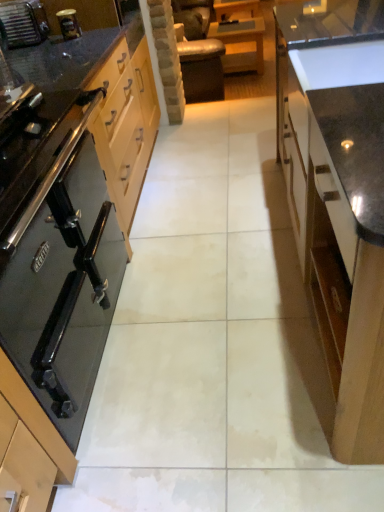
Question: Is black glass stove at left, which is the first cabinetry from left to right, to the left of brushed metal toaster at upper left from the viewer's perspective?

Choices:
 (A) no
 (B) yes

Answer: (A)

Question: Does black glass stove at left, which is counted as the 2th cabinetry, starting from the right, have a smaller size compared to brushed metal toaster at upper left?

Choices:
 (A) no
 (B) yes

Answer: (A)

Question: Considering the relative positions of black glass stove at left, which is counted as the 2th cabinetry, starting from the right, and brushed metal toaster at upper left in the image provided, is black glass stove at left, which is counted as the 2th cabinetry, starting from the right, behind brushed metal toaster at upper left?

Choices:
 (A) yes
 (B) no

Answer: (B)

Question: From a real-world perspective, is black glass stove at left, which is counted as the 2th cabinetry, starting from the right, on top of brushed metal toaster at upper left?

Choices:
 (A) no
 (B) yes

Answer: (A)

Question: Are black glass stove at left, which is counted as the 2th cabinetry, starting from the right, and brushed metal toaster at upper left located far from each other?

Choices:
 (A) no
 (B) yes

Answer: (A)

Question: Considering the positions of brushed metal toaster at upper left and wooden table at center in the image, is brushed metal toaster at upper left bigger or smaller than wooden table at center?

Choices:
 (A) big
 (B) small

Answer: (B)

Question: Visually, is brushed metal toaster at upper left positioned to the left or to the right of wooden table at center?

Choices:
 (A) right
 (B) left

Answer: (B)

Question: Considering the positions of brushed metal toaster at upper left and wooden table at center in the image, is brushed metal toaster at upper left taller or shorter than wooden table at center?

Choices:
 (A) tall
 (B) short

Answer: (B)

Question: From the image's perspective, is brushed metal toaster at upper left located above or below wooden table at center?

Choices:
 (A) above
 (B) below

Answer: (B)

Question: From a real-world perspective, is glossy wood cabinet at right, which is the second cabinetry from left to right, physically located above or below wooden table at center?

Choices:
 (A) below
 (B) above

Answer: (B)

Question: Considering the relative positions of glossy wood cabinet at right, which is the second cabinetry from left to right, and wooden table at center in the image provided, is glossy wood cabinet at right, which is the second cabinetry from left to right, to the left or to the right of wooden table at center?

Choices:
 (A) left
 (B) right

Answer: (B)

Question: Considering the positions of glossy wood cabinet at right, which ranks as the first cabinetry in right-to-left order, and wooden table at center in the image, is glossy wood cabinet at right, which ranks as the first cabinetry in right-to-left order, bigger or smaller than wooden table at center?

Choices:
 (A) small
 (B) big

Answer: (B)

Question: In the image, is glossy wood cabinet at right, which ranks as the first cabinetry in right-to-left order, positioned in front of or behind wooden table at center?

Choices:
 (A) front
 (B) behind

Answer: (A)

Question: From their relative heights in the image, would you say brushed metal toaster at upper left is taller or shorter than glossy wood cabinet at right, which ranks as the first cabinetry in right-to-left order?

Choices:
 (A) tall
 (B) short

Answer: (B)

Question: Is brushed metal toaster at upper left spatially inside glossy wood cabinet at right, which is the second cabinetry from left to right, or outside of it?

Choices:
 (A) outside
 (B) inside

Answer: (A)